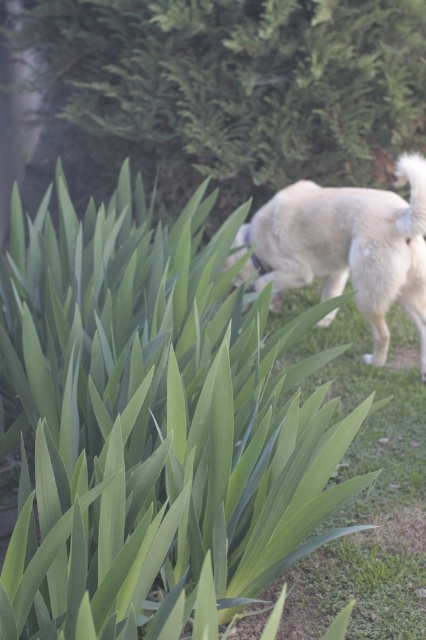
Which of these two, green leafy plant at upper left or white fabric neckband at center, stands taller?

green leafy plant at upper left is taller.

Is green leafy plant at upper left to the left of white fabric neckband at center from the viewer's perspective?

Indeed, green leafy plant at upper left is positioned on the left side of white fabric neckband at center.

Locate an element on the screen. The height and width of the screenshot is (640, 426). green leafy plant at upper left is located at coordinates (226, 90).

Does white fluffy dog at right appear on the left side of white fabric neckband at center?

In fact, white fluffy dog at right is to the right of white fabric neckband at center.

Does white fluffy dog at right appear on the right side of white fabric neckband at center?

Correct, you'll find white fluffy dog at right to the right of white fabric neckband at center.

Is point (268, 234) in front of point (261, 264)?

Yes, it is.

Locate an element on the screen. The image size is (426, 640). white fluffy dog at right is located at coordinates (351, 246).

Based on the photo, is green leafy plant at upper left to the left of white fluffy dog at right from the viewer's perspective?

Correct, you'll find green leafy plant at upper left to the left of white fluffy dog at right.

Between green leafy plant at upper left and white fluffy dog at right, which one has less height?

With less height is white fluffy dog at right.

Is point (43, 97) in front of point (362, 236)?

No.

Find the location of a particular element. green leafy plant at upper left is located at coordinates (226, 90).